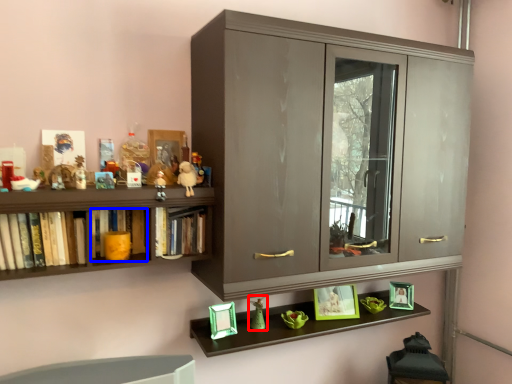
Question: Which object is closer to the camera taking this photo, toy (highlighted by a red box) or book (highlighted by a blue box)?

Choices:
 (A) toy
 (B) book

Answer: (B)